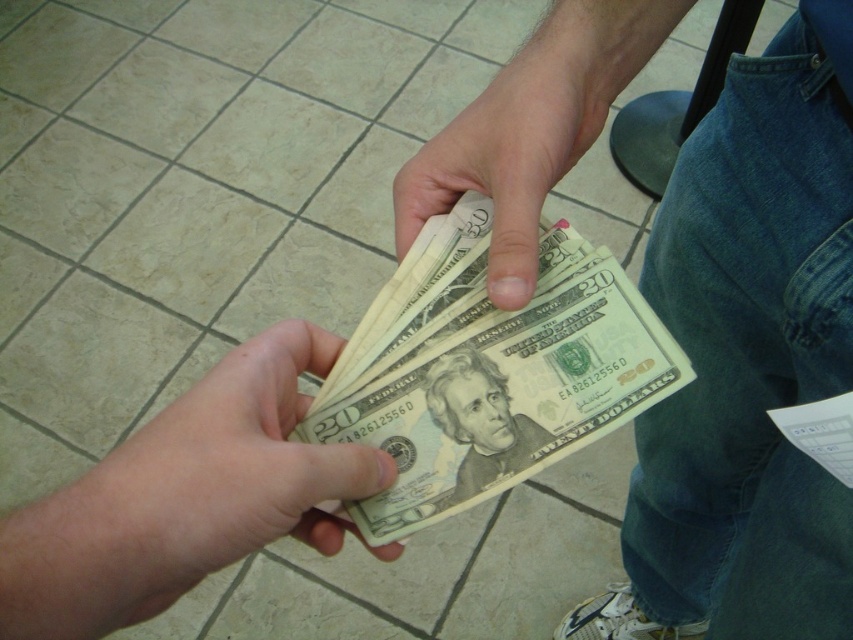
You are a cashier who needs to verify the location of the point on the twenty dollar bills. The point is at coordinate (509, 156). Where exactly on the twenty dollar bills is this point located?

The point at coordinate (509, 156) is on the matte paper money at center.

You are a cashier who needs to determine which stack of money is closer to you. You see two stacks of money in the scene, the smooth paper money at center and the light brown paper money at center. Which one is closer to you?

The smooth paper money at center is closer to the viewer than the light brown paper money at center, so the smooth paper money at center is closer to you.